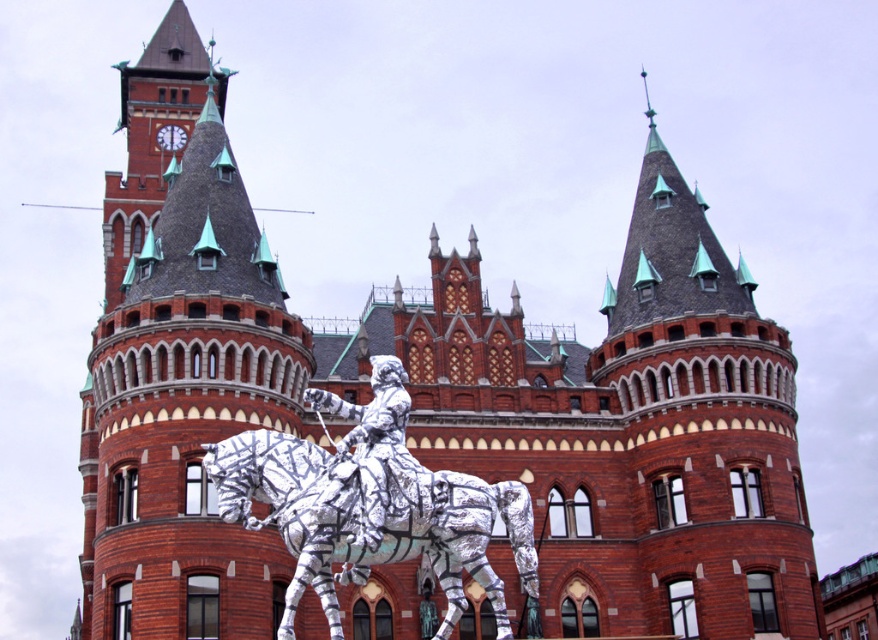
You are an art student analyzing the statue in the image. The statue consists of a silver metallic horse at center and a silver metallic horseman at center. Which part of the statue is taller?

The silver metallic horse at center is much taller than the silver metallic horseman at center according to the description.